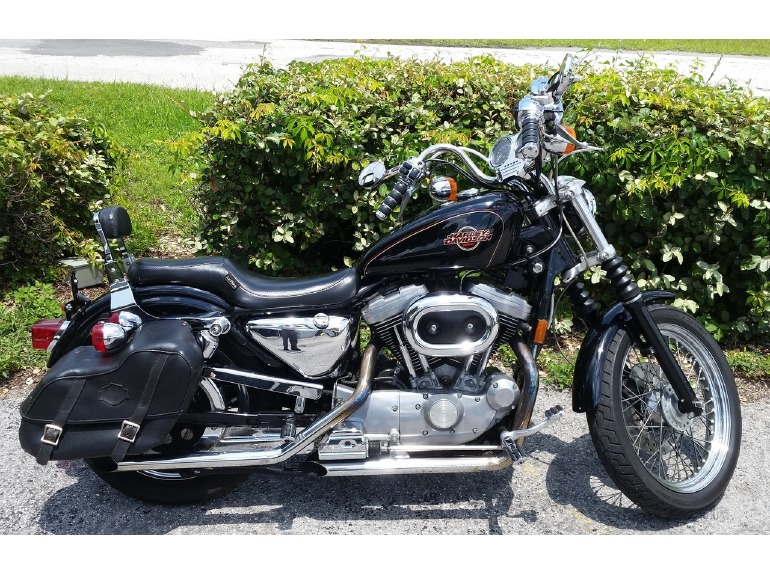
The height and width of the screenshot is (574, 770). Find the location of `black seat`. black seat is located at coordinates (262, 292), (198, 258).